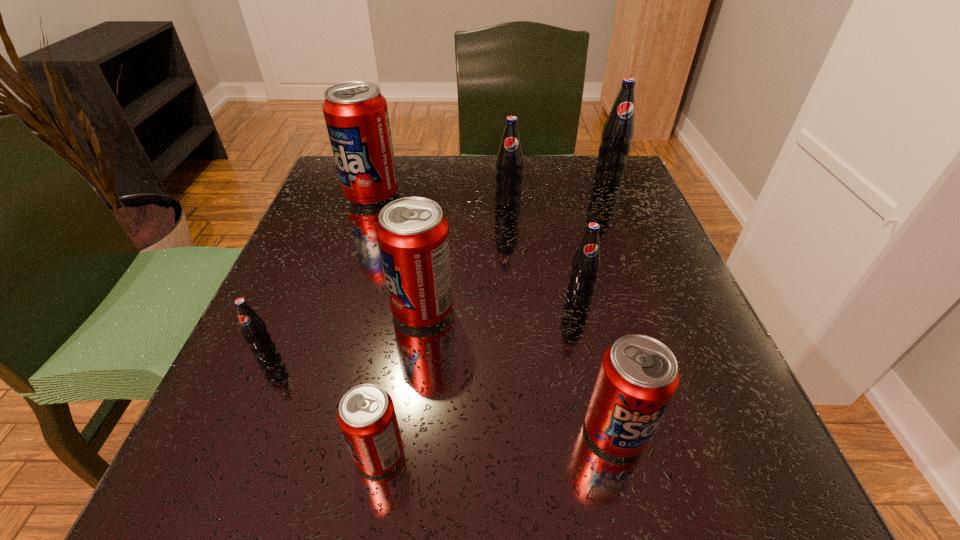
Find the location of `the rightmost object`. the rightmost object is located at coordinates (618, 132).

I want to click on the rightmost black pop, so click(618, 132).

At what (x,y) coordinates should I click in order to perform the action: click on the biggest red soda can. Please return your answer as a coordinate pair (x, y). Looking at the image, I should click on (356, 114).

In order to click on the second object from left to right in this screenshot , I will do `click(356, 114)`.

The image size is (960, 540). I want to click on the fourth soda can from right to left, so click(509, 164).

The image size is (960, 540). In order to click on the third nearest black pop in this screenshot , I will do `click(509, 164)`.

The height and width of the screenshot is (540, 960). What are the coordinates of `the second farthest red soda can` in the screenshot? It's located at (413, 233).

Locate an element on the screen. the third biggest black pop is located at coordinates (585, 265).

Image resolution: width=960 pixels, height=540 pixels. What are the coordinates of `the second nearest black pop` in the screenshot? It's located at (585, 265).

You are a GUI agent. You are given a task and a screenshot of the screen. Output one action in this format:
    pyautogui.click(x=<x>, y=<y>)
    Task: Click on the rightmost red soda can
    Image resolution: width=960 pixels, height=540 pixels.
    Given the screenshot: What is the action you would take?
    pyautogui.click(x=638, y=376)